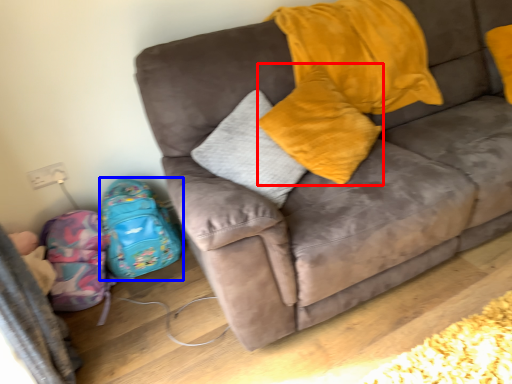
Question: Which object appears farthest to the camera in this image, pillow (highlighted by a red box) or luggage (highlighted by a blue box)?

Choices:
 (A) pillow
 (B) luggage

Answer: (B)